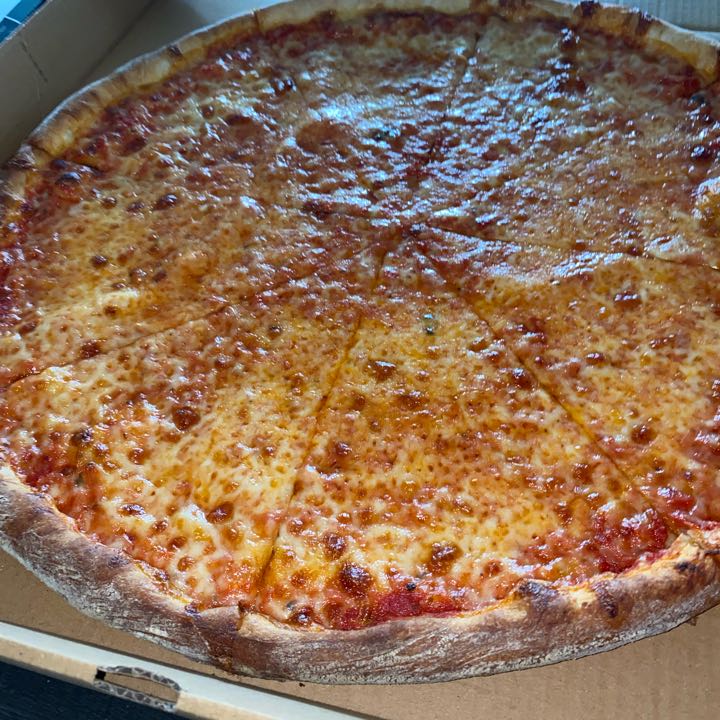
Where is `light reflection in upper middle section`? The image size is (720, 720). light reflection in upper middle section is located at coordinates (415, 125).